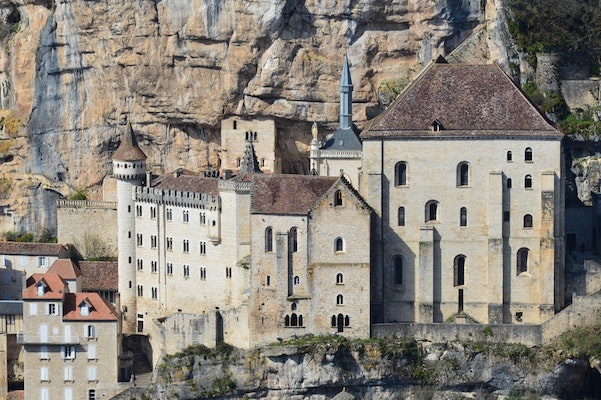
Locate an element on the screen. The height and width of the screenshot is (400, 601). wall is located at coordinates tap(449, 329), tap(557, 328).